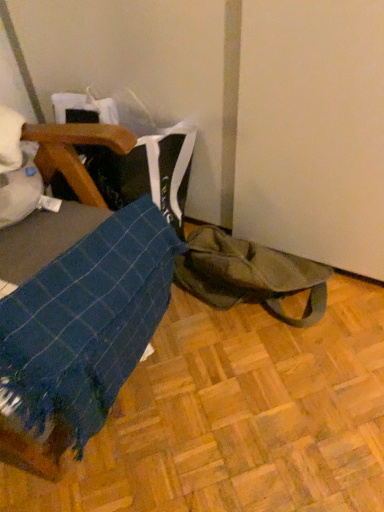
Question: Is olive green canvas tote bag at lower right oriented away from blue woven fabric at lower left?

Choices:
 (A) no
 (B) yes

Answer: (A)

Question: Would you say olive green canvas tote bag at lower right is a long distance from blue woven fabric at lower left?

Choices:
 (A) yes
 (B) no

Answer: (B)

Question: Can you confirm if olive green canvas tote bag at lower right is thinner than blue woven fabric at lower left?

Choices:
 (A) no
 (B) yes

Answer: (A)

Question: Does olive green canvas tote bag at lower right have a greater width compared to blue woven fabric at lower left?

Choices:
 (A) yes
 (B) no

Answer: (A)

Question: From a real-world perspective, is olive green canvas tote bag at lower right positioned under blue woven fabric at lower left based on gravity?

Choices:
 (A) no
 (B) yes

Answer: (B)

Question: Is blue woven fabric at lower left a part of olive green canvas tote bag at lower right?

Choices:
 (A) no
 (B) yes

Answer: (A)

Question: Is blue woven fabric at lower left beside olive green canvas tote bag at lower right?

Choices:
 (A) no
 (B) yes

Answer: (A)

Question: Is blue woven fabric at lower left thinner than olive green canvas tote bag at lower right?

Choices:
 (A) yes
 (B) no

Answer: (A)

Question: Considering the relative positions of blue woven fabric at lower left and olive green canvas tote bag at lower right in the image provided, is blue woven fabric at lower left to the right of olive green canvas tote bag at lower right from the viewer's perspective?

Choices:
 (A) yes
 (B) no

Answer: (B)

Question: Does blue woven fabric at lower left have a larger size compared to olive green canvas tote bag at lower right?

Choices:
 (A) yes
 (B) no

Answer: (A)

Question: Does blue woven fabric at lower left turn towards olive green canvas tote bag at lower right?

Choices:
 (A) yes
 (B) no

Answer: (B)

Question: From a real-world perspective, is blue woven fabric at lower left located beneath olive green canvas tote bag at lower right?

Choices:
 (A) yes
 (B) no

Answer: (B)

Question: Visually, is olive green canvas tote bag at lower right positioned to the left or to the right of blue woven fabric at lower left?

Choices:
 (A) right
 (B) left

Answer: (A)